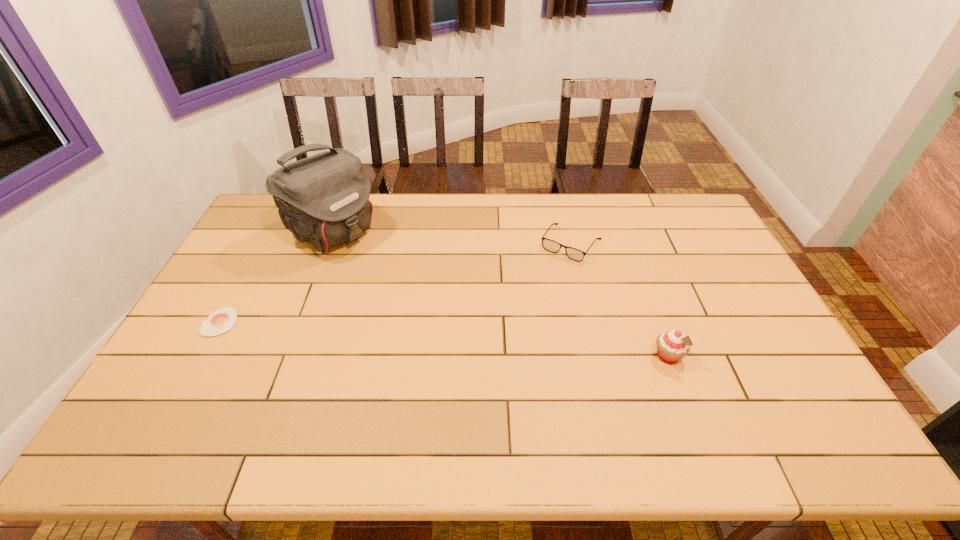
Identify the location of the third farthest object. The image size is (960, 540). (220, 321).

At what (x,y) coordinates should I click in order to perform the action: click on egg yolk. Please return your answer as a coordinate pair (x, y). The height and width of the screenshot is (540, 960). Looking at the image, I should click on (220, 321).

At what (x,y) coordinates should I click in order to perform the action: click on cupcake. Please return your answer as a coordinate pair (x, y). Image resolution: width=960 pixels, height=540 pixels. Looking at the image, I should click on (672, 346).

This screenshot has height=540, width=960. In order to click on the nearest object in this screenshot , I will do `click(672, 346)`.

Where is `the tallest object`? This screenshot has height=540, width=960. the tallest object is located at coordinates (323, 199).

Where is `shoulder bag`? shoulder bag is located at coordinates (323, 199).

This screenshot has width=960, height=540. Find the location of `the third object from left to right`. the third object from left to right is located at coordinates (549, 245).

This screenshot has width=960, height=540. I want to click on the third tallest object, so click(x=549, y=245).

The image size is (960, 540). I want to click on vacant space located 0.150m on the back of the leftmost object, so click(x=247, y=273).

At what (x,y) coordinates should I click in order to perform the action: click on free location located 0.200m on the left of the rightmost object. Please return your answer as a coordinate pair (x, y). The image size is (960, 540). Looking at the image, I should click on (578, 356).